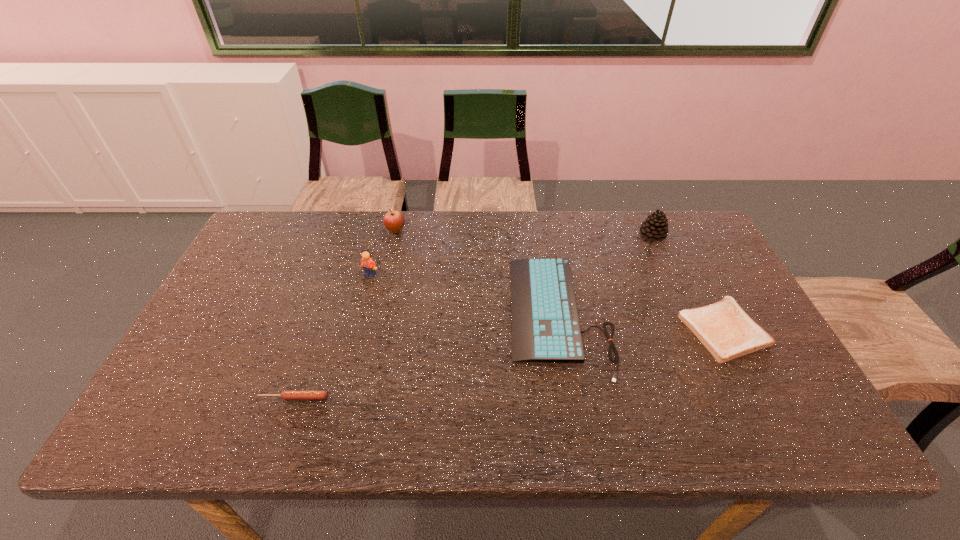
The width and height of the screenshot is (960, 540). Find the location of `pinecone`. pinecone is located at coordinates (655, 227).

Where is `apple`? The image size is (960, 540). apple is located at coordinates (394, 221).

The width and height of the screenshot is (960, 540). Identify the location of Lego. coord(368,264).

Where is `computer keyboard`? computer keyboard is located at coordinates (545, 326).

At what (x,y) coordinates should I click in order to perform the action: click on the fourth object from left to right. Please return your answer as a coordinate pair (x, y). Image resolution: width=960 pixels, height=540 pixels. Looking at the image, I should click on (545, 326).

Identify the location of the nearest object. This screenshot has width=960, height=540. (286, 395).

Where is `the second shortest object`? This screenshot has height=540, width=960. the second shortest object is located at coordinates (286, 395).

Find the location of a particular element. toast is located at coordinates (724, 328).

Where is `vacant region located at the narrow end of the pinecone`? The height and width of the screenshot is (540, 960). vacant region located at the narrow end of the pinecone is located at coordinates (535, 235).

Identify the location of vacant space located 0.070m at the narrow end of the pinecone. (617, 235).